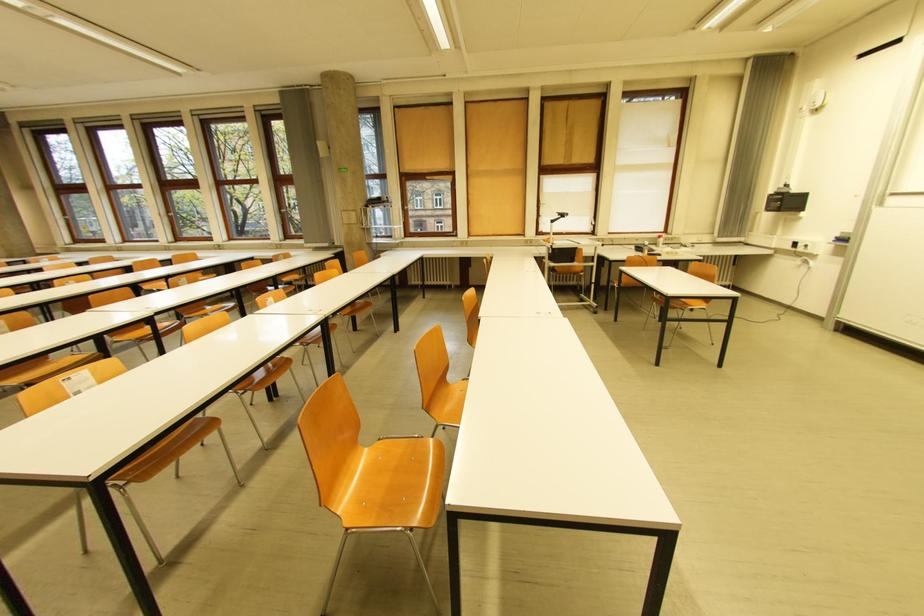
Identify the location of tan window shade. The width and height of the screenshot is (924, 616). (495, 166).